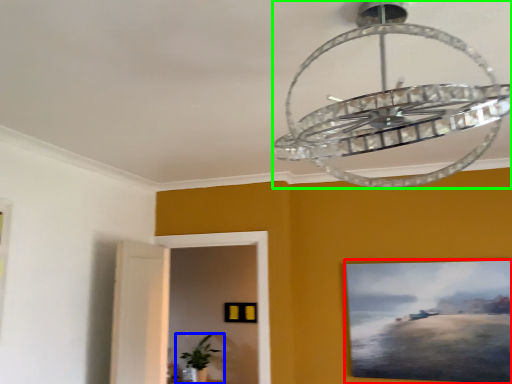
Question: Based on their relative distances, which object is farther from picture frame (highlighted by a red box)? Choose from houseplant (highlighted by a blue box) and lamp (highlighted by a green box).

Choices:
 (A) houseplant
 (B) lamp

Answer: (A)